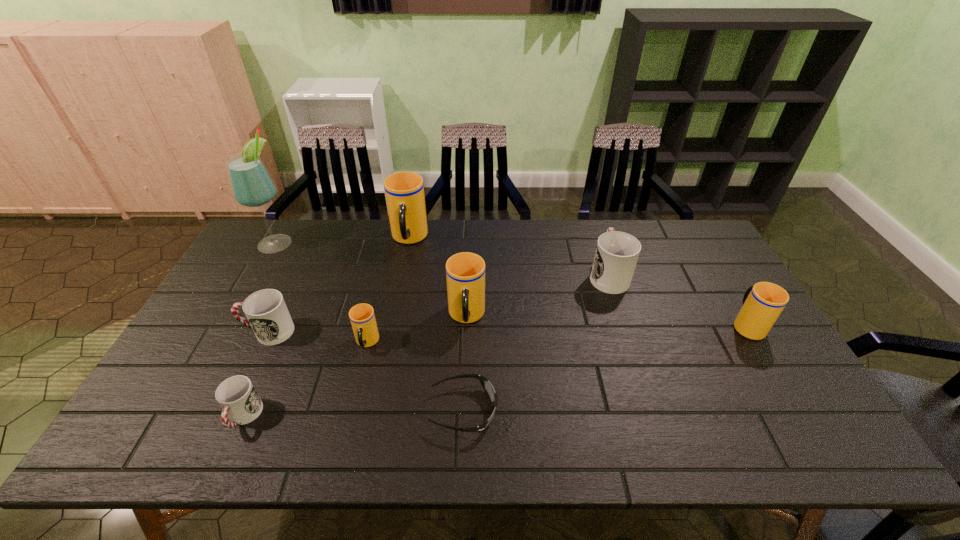
Identify which object is the second closest to the eighth shortest object. Please provide its 2D coordinates. Your answer should be formatted as a tuple, i.e. [(x, y)], where the tuple contains the x and y coordinates of a point satisfying the conditions above.

[(252, 186)]

Find the location of `the sixth closest cup to the alcohol`. the sixth closest cup to the alcohol is located at coordinates (616, 255).

At what (x,y) coordinates should I click in order to perform the action: click on cup that is the third nearest to the shortest object. Please return your answer as a coordinate pair (x, y). The width and height of the screenshot is (960, 540). Looking at the image, I should click on (x=237, y=396).

Locate an element on the screen. The width and height of the screenshot is (960, 540). beige cup that is the second closest to the seventh nearest object is located at coordinates (465, 272).

Select which beige cup is the closest to the smallest beige cup. Please provide its 2D coordinates. Your answer should be formatted as a tuple, i.e. [(x, y)], where the tuple contains the x and y coordinates of a point satisfying the conditions above.

[(465, 272)]

This screenshot has height=540, width=960. Identify the location of red cup that is the third closest to the second tallest object. (237, 396).

Locate which red cup ranks in proximity to the rightmost beige cup. Please provide its 2D coordinates. Your answer should be formatted as a tuple, i.e. [(x, y)], where the tuple contains the x and y coordinates of a point satisfying the conditions above.

[(616, 255)]

Image resolution: width=960 pixels, height=540 pixels. I want to click on vacant area in the image that satisfies the following two spatial constraints: 1. on the lenses of the sunglasses; 2. on the side of the smallest red cup where the handle is located, so click(464, 417).

I want to click on free spot that satisfies the following two spatial constraints: 1. on the side of the second biggest red cup where the handle is located; 2. on the side of the second farthest cup where the handle is located, so click(x=295, y=274).

You are a GUI agent. You are given a task and a screenshot of the screen. Output one action in this format:
    pyautogui.click(x=<x>, y=<y>)
    Task: Click on the free space that satisfies the following two spatial constraints: 1. on the side of the sixth shortest cup with the handle; 2. on the lenses of the sunglasses
    This screenshot has height=540, width=960.
    Given the screenshot: What is the action you would take?
    pyautogui.click(x=464, y=410)